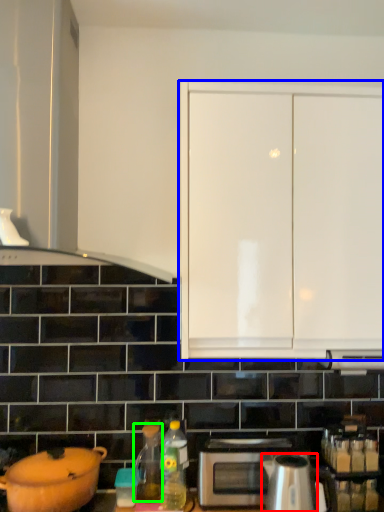
Question: Considering the real-world distances, which object is farthest from kitchen appliance (highlighted by a red box)? cabinetry (highlighted by a blue box) or tea pot (highlighted by a green box)?

Choices:
 (A) cabinetry
 (B) tea pot

Answer: (A)